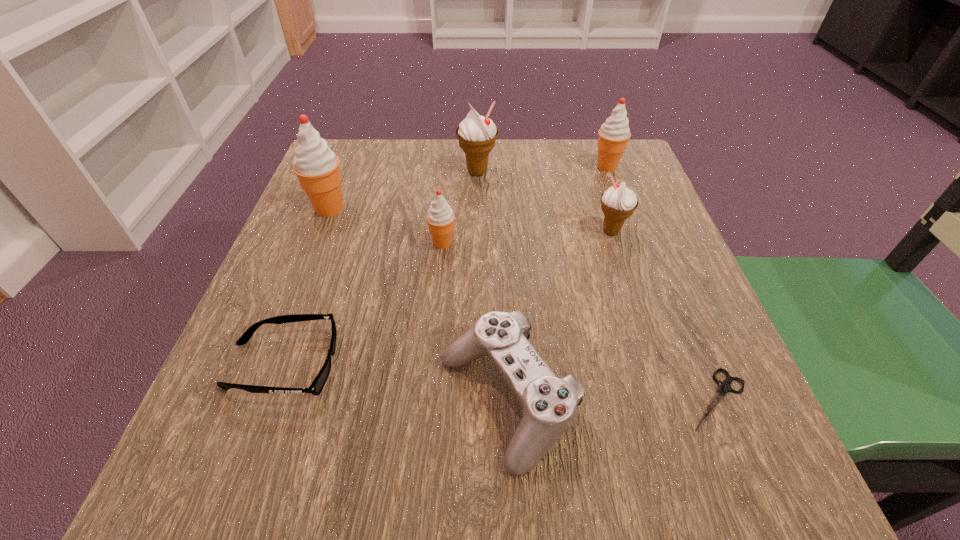
Locate which red icecream ranks second in proximity to the tallest icecream. Please provide its 2D coordinates. Your answer should be formatted as a tuple, i.e. [(x, y)], where the tuple contains the x and y coordinates of a point satisfying the conditions above.

[(614, 134)]

The width and height of the screenshot is (960, 540). Find the location of `free spot that satisfies the following two spatial constraints: 1. on the front-facing side of the second shortest object; 2. on the left side of the black shears`. free spot that satisfies the following two spatial constraints: 1. on the front-facing side of the second shortest object; 2. on the left side of the black shears is located at coordinates (271, 399).

Locate an element on the screen. This screenshot has width=960, height=540. free point that satisfies the following two spatial constraints: 1. on the front side of the white control; 2. on the right side of the bigger white icecream is located at coordinates (475, 401).

At what (x,y) coordinates should I click in order to perform the action: click on vacant region that satisfies the following two spatial constraints: 1. on the back side of the shears; 2. on the front-facing side of the black sunglasses. Please return your answer as a coordinate pair (x, y). Image resolution: width=960 pixels, height=540 pixels. Looking at the image, I should click on (704, 365).

The image size is (960, 540). I want to click on vacant area in the image that satisfies the following two spatial constraints: 1. on the front side of the tallest icecream; 2. on the left side of the black shears, so click(255, 399).